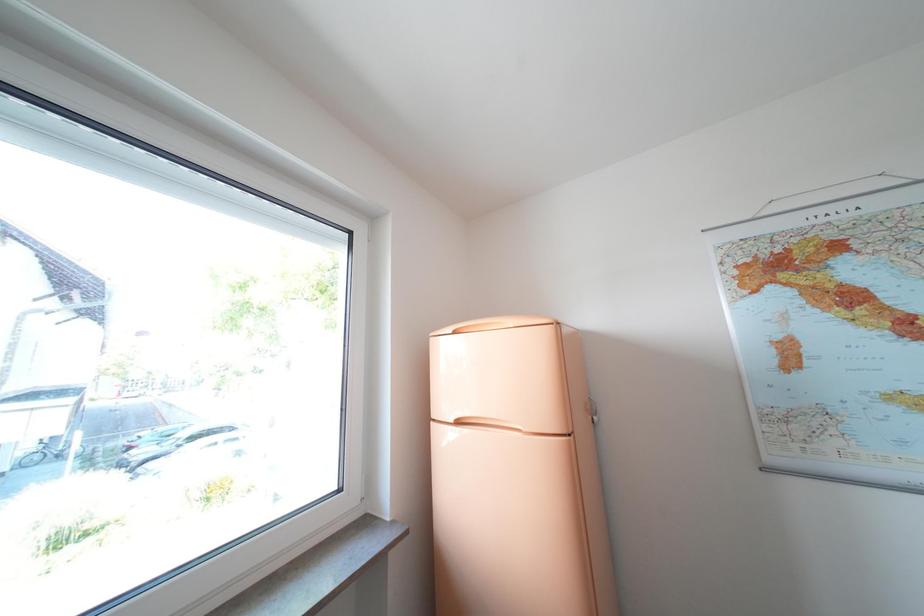
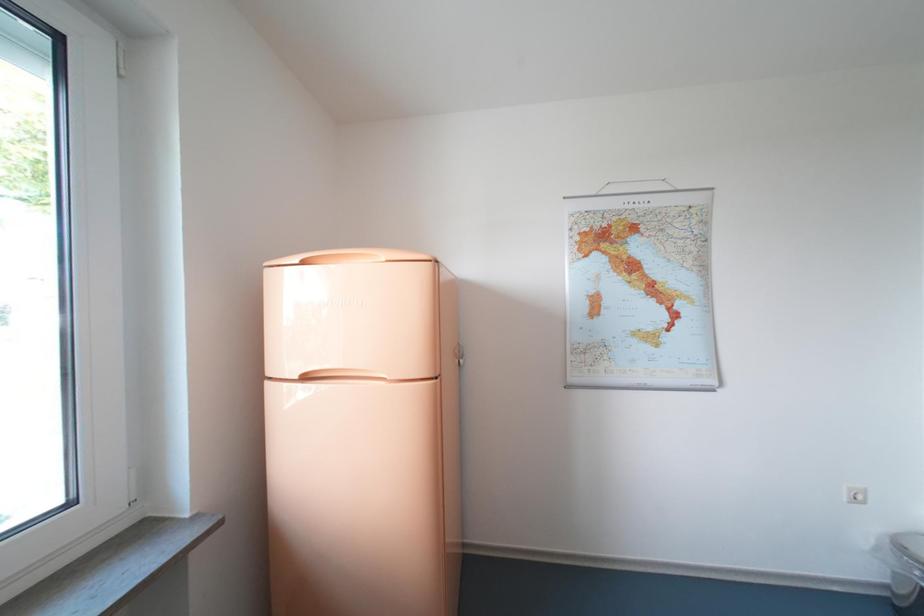
The images are taken continuously from a first-person perspective. In which direction are you moving?

The cameraman walked toward right, forward.